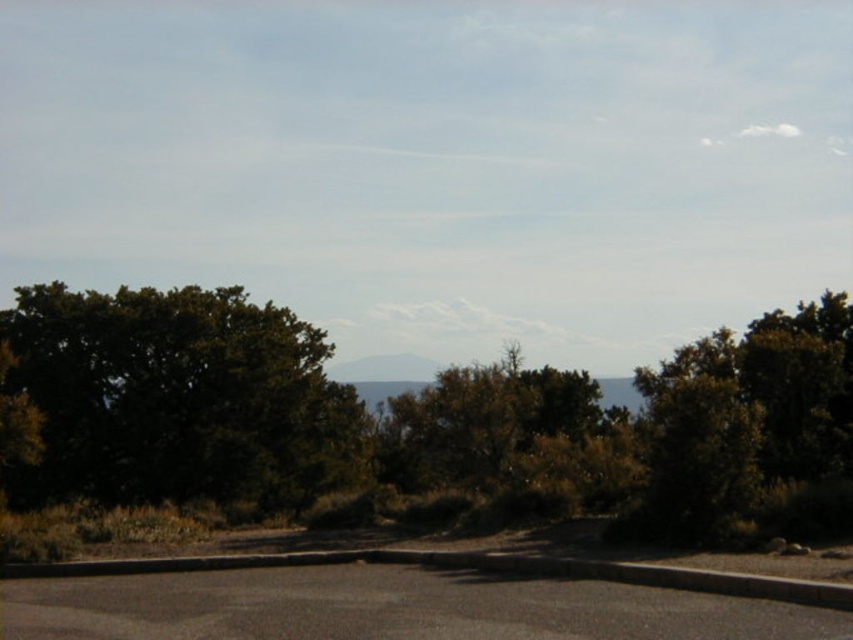
Question: Is green leafy tree at left to the left of green leafy tree at center from the viewer's perspective?

Choices:
 (A) no
 (B) yes

Answer: (B)

Question: Which object is farther from the camera taking this photo?

Choices:
 (A) green leafy tree at left
 (B) green leafy tree at center

Answer: (A)

Question: Is green leafy tree at left to the left of green leafy tree at center from the viewer's perspective?

Choices:
 (A) no
 (B) yes

Answer: (B)

Question: Does green leafy tree at left lie behind green leafy tree at center?

Choices:
 (A) yes
 (B) no

Answer: (A)

Question: Among these objects, which one is nearest to the camera?

Choices:
 (A) green leafy tree at center
 (B) green leafy tree at left

Answer: (A)